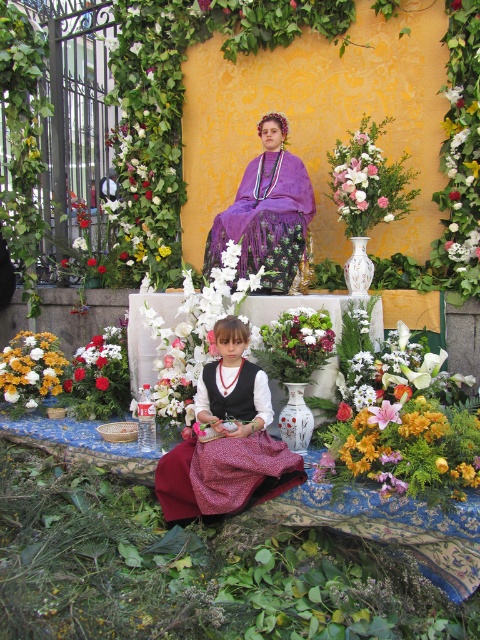
You are a guest at this event and want to place a small gift on the table where the white glossy vase at center and the matte yellow flowers at lower left are located. Where should you place the gift so it doesn not block the vase or the flowers?

Place the gift to the right of the white glossy vase at center since it is already positioned to the right of the matte yellow flowers at lower left, leaving space on its right side available.

You are a photographer at this event and need to capture a closeup of both the purple satin dress at center and the white glossy vase at center. Since your camera can only focus on one object at a time, which object should you choose to ensure the subject fills the frame more effectively?

The purple satin dress at center is larger in size than the white glossy vase at center, so choosing the purple satin dress at center will fill the frame more effectively.